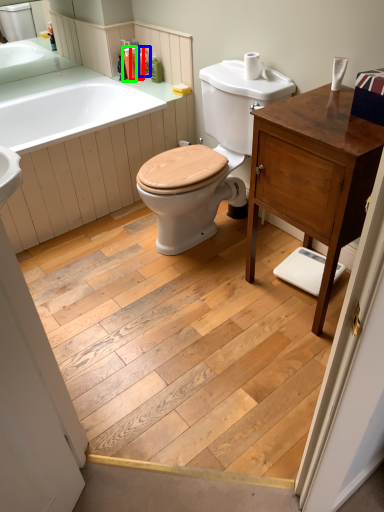
Question: Which object is the closest to the toiletry (highlighted by a red box)? Choose among these: toiletry (highlighted by a blue box) or toiletry (highlighted by a green box).

Choices:
 (A) toiletry
 (B) toiletry

Answer: (B)